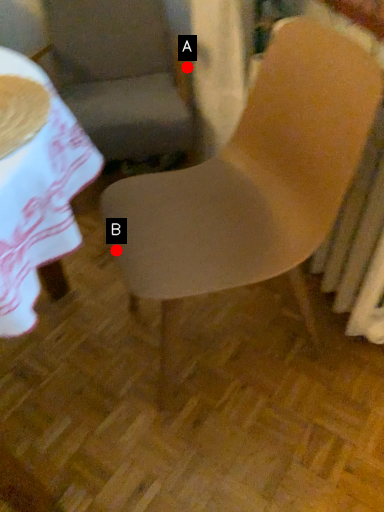
Question: Two points are circled on the image, labeled by A and B beside each circle. Which point appears closest to the camera in this image?

Choices:
 (A) A is closer
 (B) B is closer

Answer: (B)